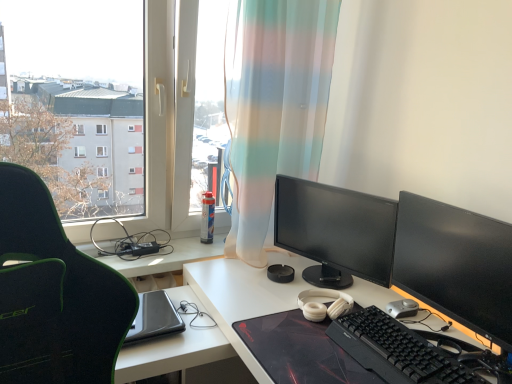
Image resolution: width=512 pixels, height=384 pixels. I want to click on vacant space situated on the left part of white matte headphones at center, so click(264, 295).